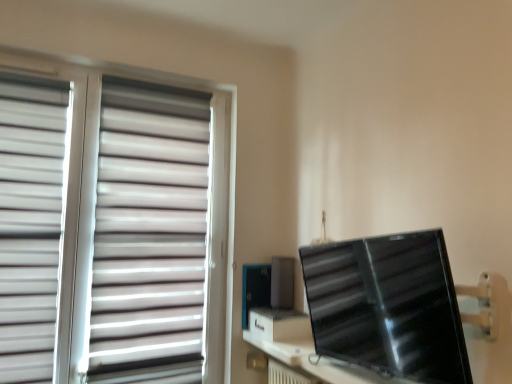
Question: Relative to black glossy monitor at right, is white matte blinds at left, the second curtain viewed from the right, in front or behind?

Choices:
 (A) behind
 (B) front

Answer: (A)

Question: From the image's perspective, is white matte blinds at left, the second curtain viewed from the right, positioned above or below black glossy monitor at right?

Choices:
 (A) below
 (B) above

Answer: (B)

Question: Based on their relative distances, which object is farther from the white matte blinds at left, the second curtain viewed from the right?

Choices:
 (A) black glossy monitor at right
 (B) white matte blinds at left
 (C) white matte blinds at left, marked as the 1th curtain in a right-to-left arrangement

Answer: (A)

Question: Which is farther from the black glossy monitor at right?

Choices:
 (A) white matte blinds at left
 (B) white matte blinds at left, marked as the 1th curtain in a right-to-left arrangement
 (C) white matte blinds at left, the second curtain viewed from the right

Answer: (C)